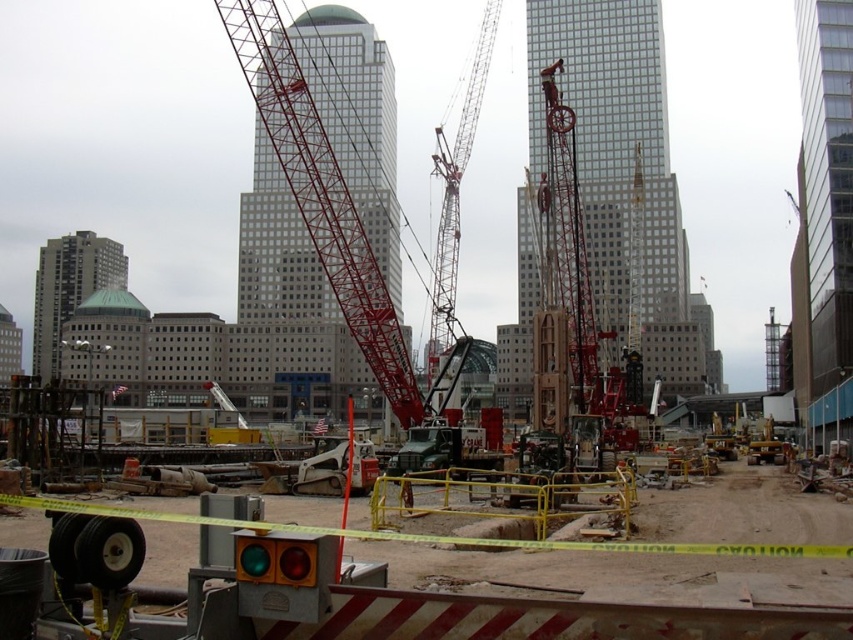
Looking at this image, does glassy reflective skyscraper at center appear under gray concrete building at left?

No, glassy reflective skyscraper at center is not below gray concrete building at left.

Where is `glassy reflective skyscraper at center`? This screenshot has width=853, height=640. glassy reflective skyscraper at center is located at coordinates (822, 196).

The height and width of the screenshot is (640, 853). What are the coordinates of `glassy reflective skyscraper at center` in the screenshot? It's located at (822, 196).

Between point (323, 596) and point (113, 276), which one is positioned in front?

Point (323, 596) is in front.

Can you confirm if yellow caution tape at center is wider than gray concrete building at left?

No, yellow caution tape at center is not wider than gray concrete building at left.

Between point (296, 611) and point (73, 259), which one is positioned in front?

Point (296, 611) is more forward.

This screenshot has height=640, width=853. In order to click on yellow caution tape at center in this screenshot , I will do `click(335, 593)`.

Can you confirm if white glass skyscraper at center is wider than glassy reflective skyscraper at center?

Indeed, white glass skyscraper at center has a greater width compared to glassy reflective skyscraper at center.

Is white glass skyscraper at center taller than glassy reflective skyscraper at center?

Correct, white glass skyscraper at center is much taller as glassy reflective skyscraper at center.

Who is more distant from viewer, (376, 204) or (827, 61)?

The point (376, 204) is behind.

What are the coordinates of `white glass skyscraper at center` in the screenshot? It's located at (357, 120).